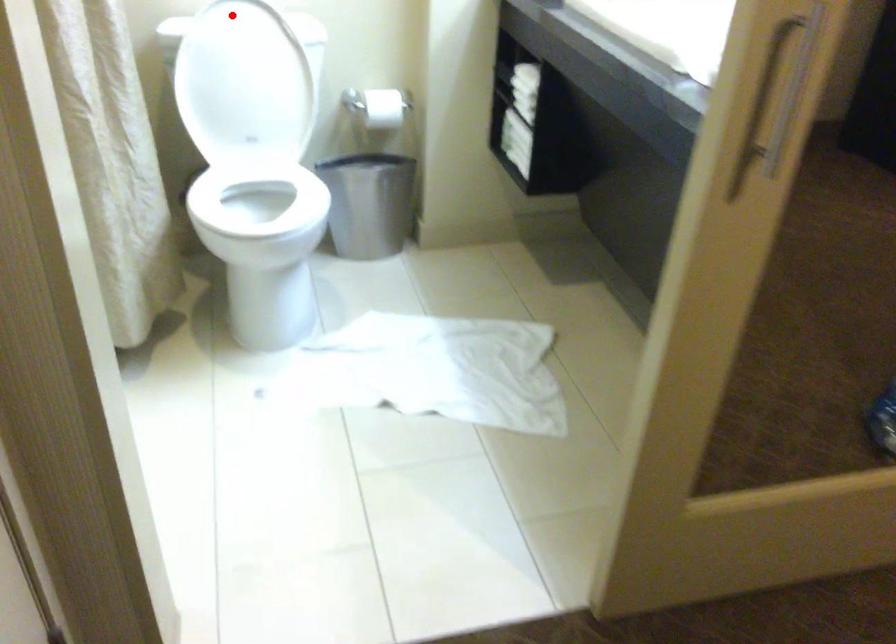
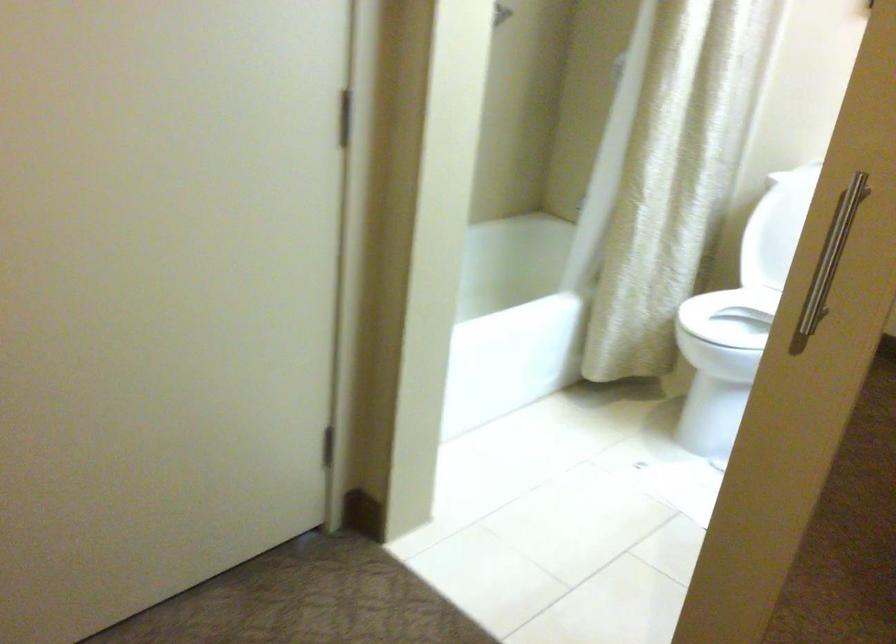
Question: I am providing you with two images of the same scene from different viewpoints. A red point is marked on the first image. At the location where the point appears in image 1, is it still visible in image 2?

Choices:
 (A) Yes
 (B) No

Answer: (B)